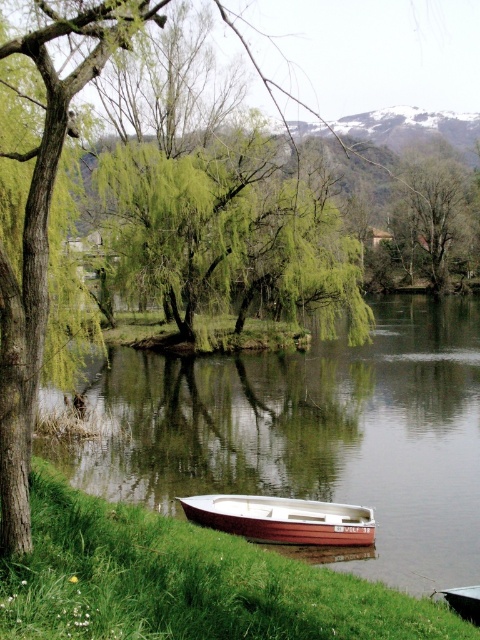
Question: Can you confirm if green grass at lower left is smaller than white wooden boat at lower center?

Choices:
 (A) no
 (B) yes

Answer: (B)

Question: Observing the image, what is the correct spatial positioning of smooth brown water at lower center in reference to green grass at lower left?

Choices:
 (A) right
 (B) left

Answer: (A)

Question: Which point is closer to the camera?

Choices:
 (A) smooth brown water at lower center
 (B) white wooden boat at lower center

Answer: (B)

Question: Which object is positioned farthest from the green leafy tree at center?

Choices:
 (A) wooden boat at lower center
 (B) green grass at lower left

Answer: (B)

Question: Which object is the closest to the smooth brown water at lower center?

Choices:
 (A) white wooden boat at lower center
 (B) wooden boat at lower center

Answer: (B)

Question: Does wooden boat at lower center appear under white wooden boat at lower center?

Choices:
 (A) yes
 (B) no

Answer: (A)